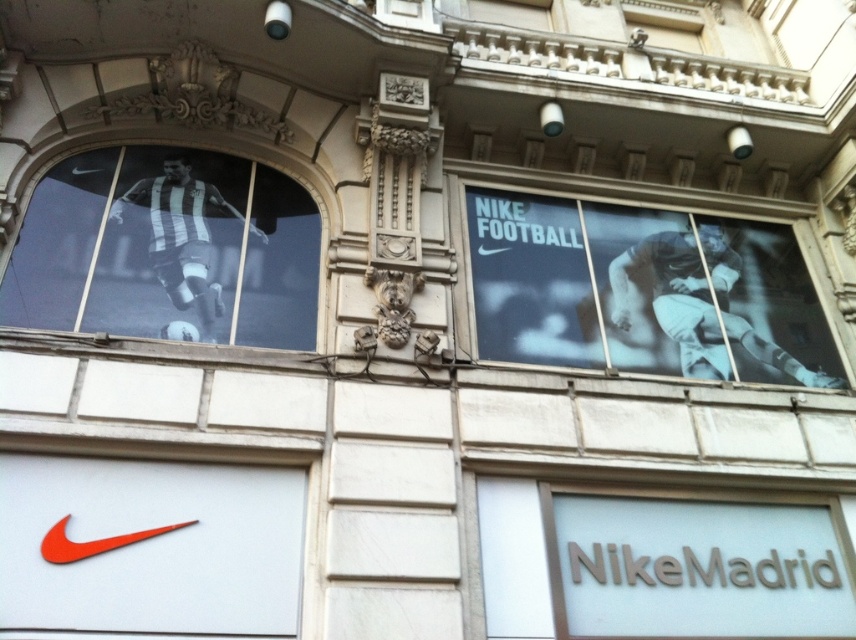
You are a customer looking at the Nike store facade. You see the blue fabric poster at right and the black and white striped jersey at upper left. Which of these two items is positioned more to the right side of the store facade?

The blue fabric poster at right is positioned more to the right side of the store facade than the black and white striped jersey at upper left.

You are a window dresser planning to place a new decorative item between the blue fabric poster at right and the black and white striped jersey at upper left. Based on their sizes, which object should you place closer to the center of the window to balance the display?

The blue fabric poster at right is larger than the black and white striped jersey at upper left. To balance the display, place the larger blue fabric poster at right closer to the center and the smaller jersey further away, as larger items are typically placed centrally for visual balance.